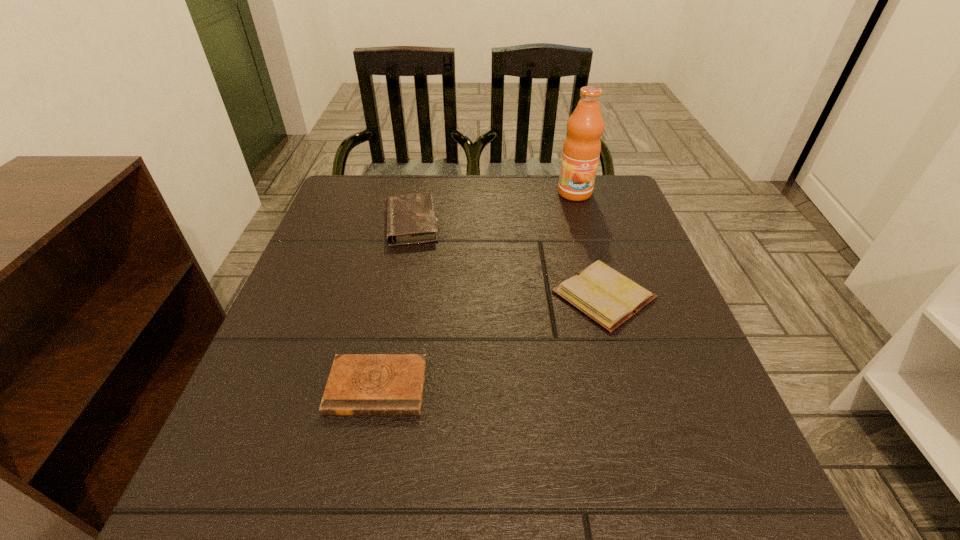
Where is `the farthest object`? This screenshot has width=960, height=540. the farthest object is located at coordinates (582, 146).

At what (x,y) coordinates should I click in order to perform the action: click on fruit juice. Please return your answer as a coordinate pair (x, y). The width and height of the screenshot is (960, 540). Looking at the image, I should click on click(x=582, y=146).

Image resolution: width=960 pixels, height=540 pixels. What are the coordinates of `the third shortest object` in the screenshot? It's located at (411, 218).

Where is `the tallest diary`? This screenshot has height=540, width=960. the tallest diary is located at coordinates (411, 218).

At what (x,y) coordinates should I click in order to perform the action: click on the second farthest diary. Please return your answer as a coordinate pair (x, y). The width and height of the screenshot is (960, 540). Looking at the image, I should click on (609, 298).

Identify the location of the rightmost diary. (609, 298).

I want to click on the nearest diary, so click(359, 384).

Locate an element on the screen. free space located on the label side of the farthest object is located at coordinates (601, 280).

What are the coordinates of `vacant space located on the front of the second farthest object` in the screenshot? It's located at (382, 374).

Locate an element on the screen. This screenshot has width=960, height=540. vacant space located 0.160m on the left of the rightmost diary is located at coordinates (475, 295).